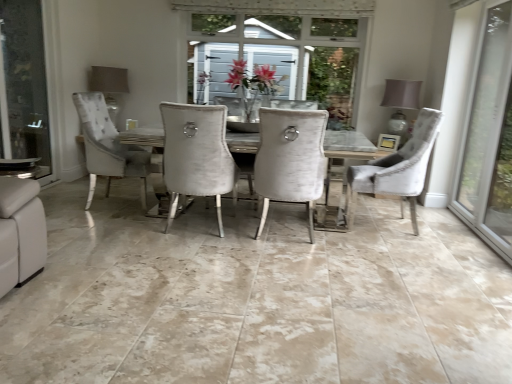
Find the location of a particular element. The image size is (512, 384). vacant space to the right of clear glass screen door at left is located at coordinates (70, 194).